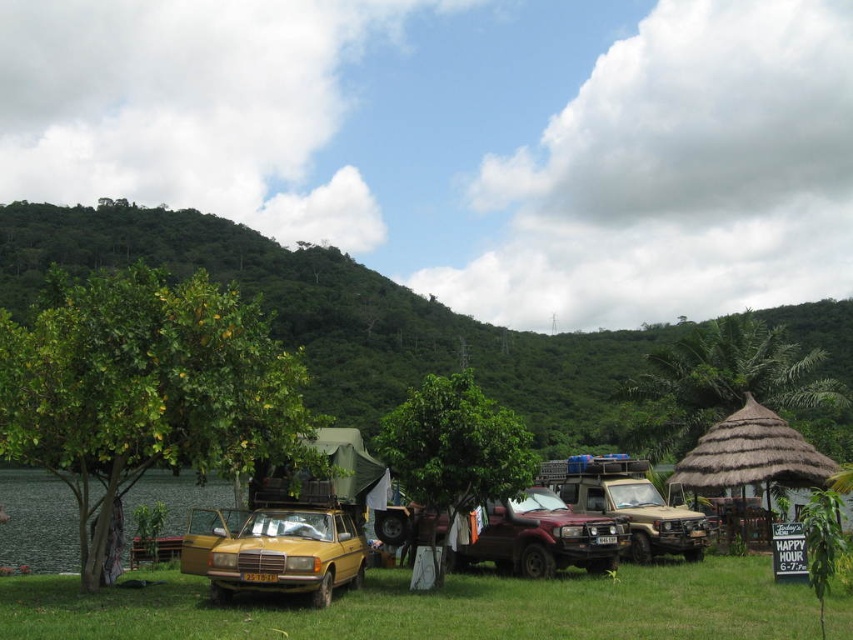
Based on the photo, how much distance is there between matte yellow car at center and rustic metallic suv at center?

matte yellow car at center is 18.51 feet from rustic metallic suv at center.

Can you confirm if matte yellow car at center is positioned to the right of rustic metallic suv at center?

No, matte yellow car at center is not to the right of rustic metallic suv at center.

Which is in front, point (257, 554) or point (607, 564)?

Point (257, 554) is more forward.

Identify the location of matte yellow car at center. Image resolution: width=853 pixels, height=640 pixels. (274, 552).

Can you confirm if matte yellow car at center is smaller than beige matte jeep at center?

Indeed, matte yellow car at center has a smaller size compared to beige matte jeep at center.

Does point (247, 513) come farther from viewer compared to point (643, 515)?

No, (247, 513) is in front of (643, 515).

The width and height of the screenshot is (853, 640). In order to click on matte yellow car at center in this screenshot , I will do `click(274, 552)`.

Between green grassy field at lower center and thatched straw hut at right, which one has more height?

Standing taller between the two is thatched straw hut at right.

Is green grassy field at lower center to the right of thatched straw hut at right from the viewer's perspective?

No, green grassy field at lower center is not to the right of thatched straw hut at right.

Does point (331, 625) come in front of point (793, 461)?

Yes, point (331, 625) is in front of point (793, 461).

Find the location of `green grassy field at lower center`. green grassy field at lower center is located at coordinates (433, 608).